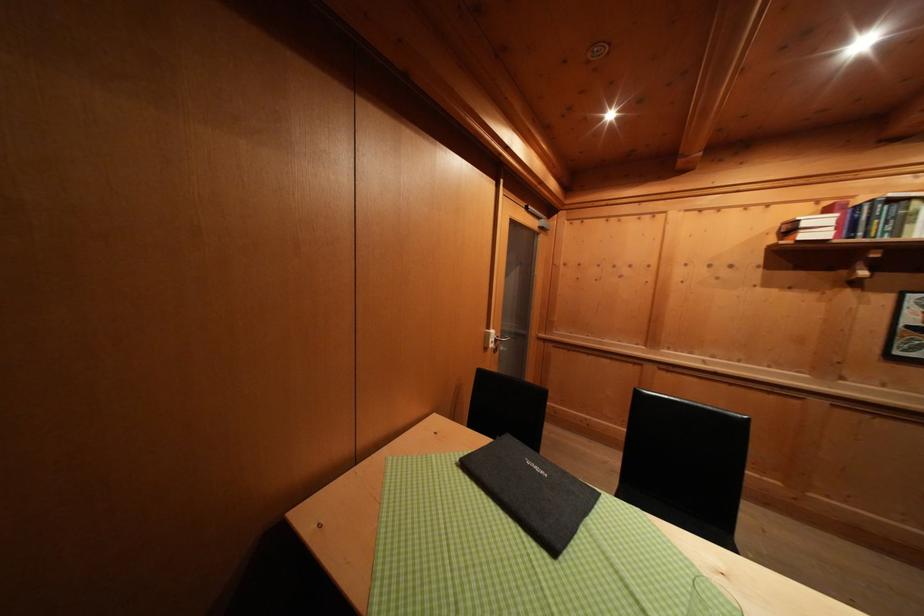
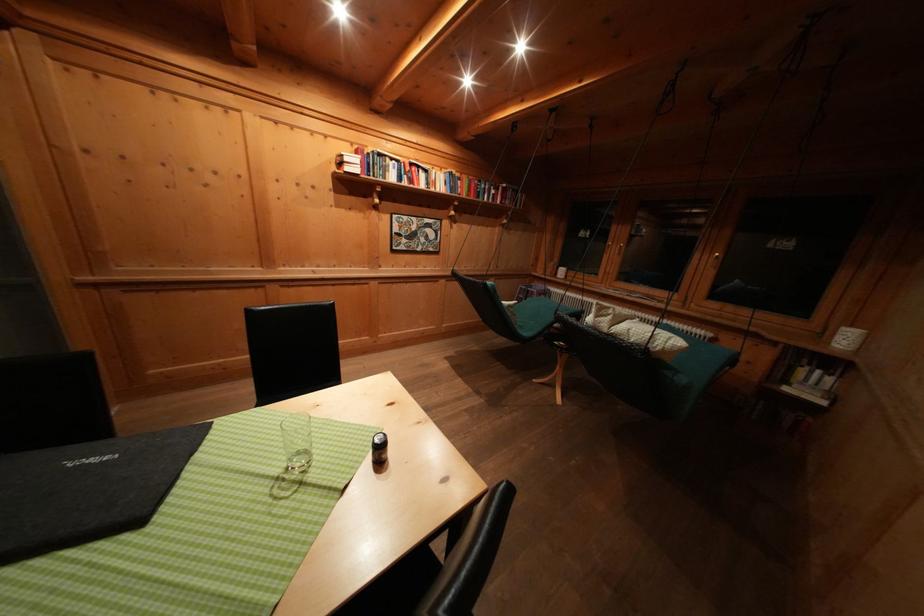
First-person continuous shooting, in which direction is the camera rotating?

The camera rotated toward right-down.